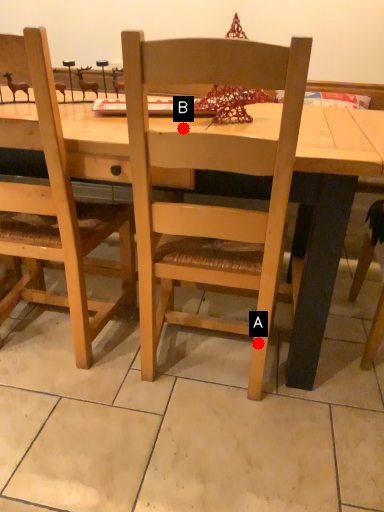
Question: Two points are circled on the image, labeled by A and B beside each circle. Which point is further to the camera?

Choices:
 (A) A is further
 (B) B is further

Answer: (A)